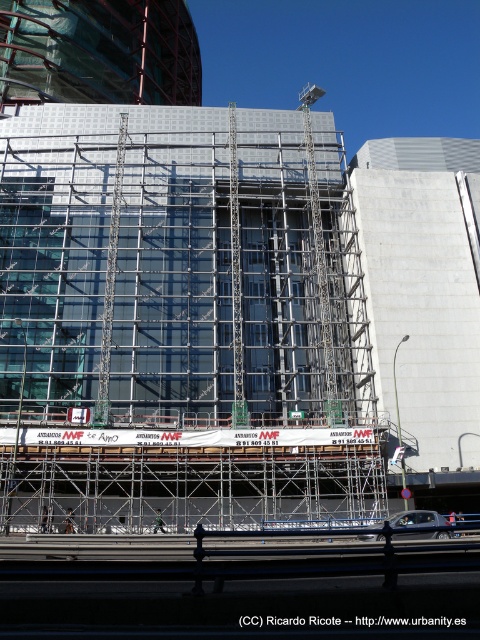
Question: Among these objects, which one is farthest from the camera?

Choices:
 (A) metal scaffolding at center
 (B) metallic helmet at center

Answer: (B)

Question: Considering the relative positions of metal scaffolding at center and metallic helmet at center in the image provided, where is metal scaffolding at center located with respect to metallic helmet at center?

Choices:
 (A) above
 (B) below

Answer: (A)

Question: From the image, what is the correct spatial relationship of metal scaffolding at center in relation to metallic helmet at center?

Choices:
 (A) right
 (B) left

Answer: (A)

Question: Which point is farther from the camera taking this photo?

Choices:
 (A) (156, 524)
 (B) (342, 236)

Answer: (B)

Question: Where is metal scaffolding at center located in relation to metallic helmet at center in the image?

Choices:
 (A) right
 (B) left

Answer: (A)